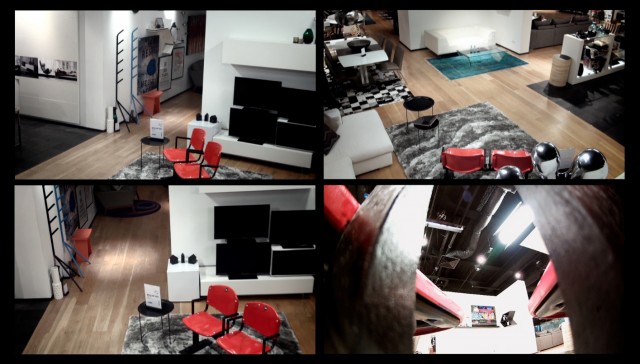
Where is `grey rug`? grey rug is located at coordinates (150, 342).